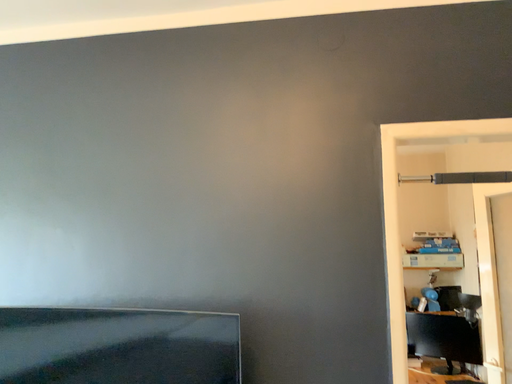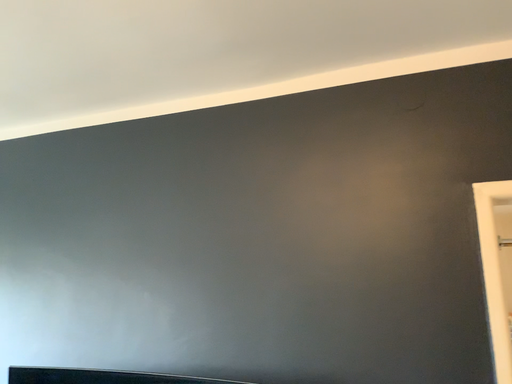
Question: How did the camera likely rotate when shooting the video?

Choices:
 (A) rotated right
 (B) rotated left

Answer: (B)